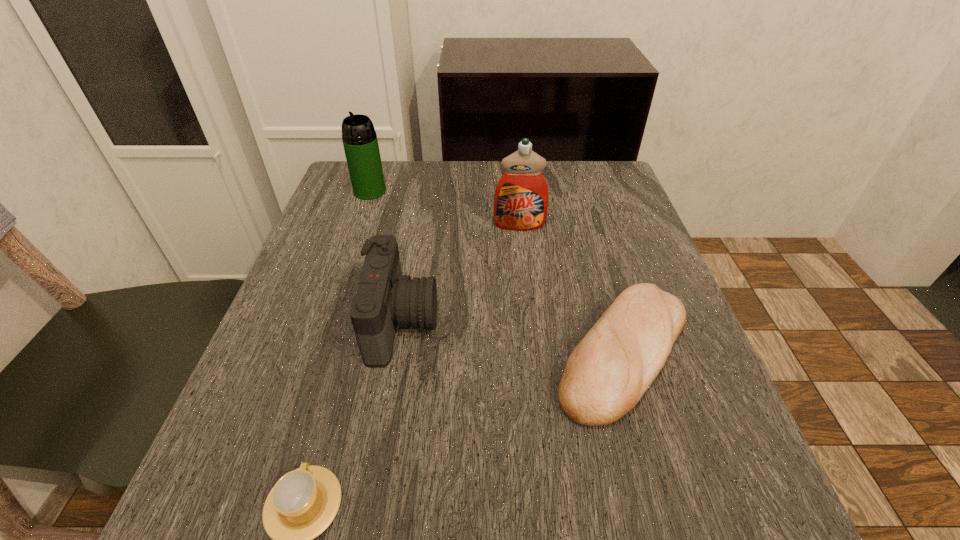
The height and width of the screenshot is (540, 960). I want to click on object positioned at the right edge, so click(607, 373).

Locate an element on the screen. The height and width of the screenshot is (540, 960). object present at the far left corner is located at coordinates (360, 142).

Where is `vacant region at the far edge of the desktop`? The height and width of the screenshot is (540, 960). vacant region at the far edge of the desktop is located at coordinates (447, 206).

You are a GUI agent. You are given a task and a screenshot of the screen. Output one action in this format:
    pyautogui.click(x=<x>, y=<y>)
    Task: Click on the vacant space at the near edge of the desktop
    This screenshot has width=960, height=540.
    Given the screenshot: What is the action you would take?
    pyautogui.click(x=478, y=511)

In the image, there is a desktop. Where is `free space at the left edge`? free space at the left edge is located at coordinates (263, 386).

In order to click on vacant region at the right edge of the desktop in this screenshot , I will do `click(663, 372)`.

Locate an element on the screen. The image size is (960, 540). vacant position at the far left corner of the desktop is located at coordinates (367, 203).

This screenshot has height=540, width=960. What are the coordinates of `vacant space at the far right corner of the desktop` in the screenshot? It's located at (626, 191).

You are a GUI agent. You are given a task and a screenshot of the screen. Output one action in this format:
    pyautogui.click(x=<x>, y=<y>)
    Task: Click on the unoccupied area between the farthest object and the bread
    The image size is (960, 540).
    Given the screenshot: What is the action you would take?
    pyautogui.click(x=496, y=272)

Identify the location of free space that is in between the thermos bottle and the bread. Image resolution: width=960 pixels, height=540 pixels. (496, 272).